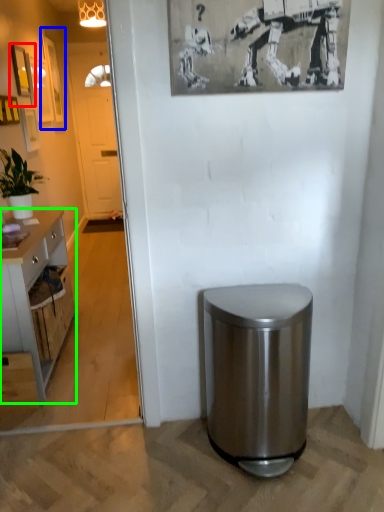
Question: Estimate the real-world distances between objects in this image. Which object is farther from picture frame (highlighted by a red box), picture frame (highlighted by a blue box) or cabinetry (highlighted by a green box)?

Choices:
 (A) picture frame
 (B) cabinetry

Answer: (B)